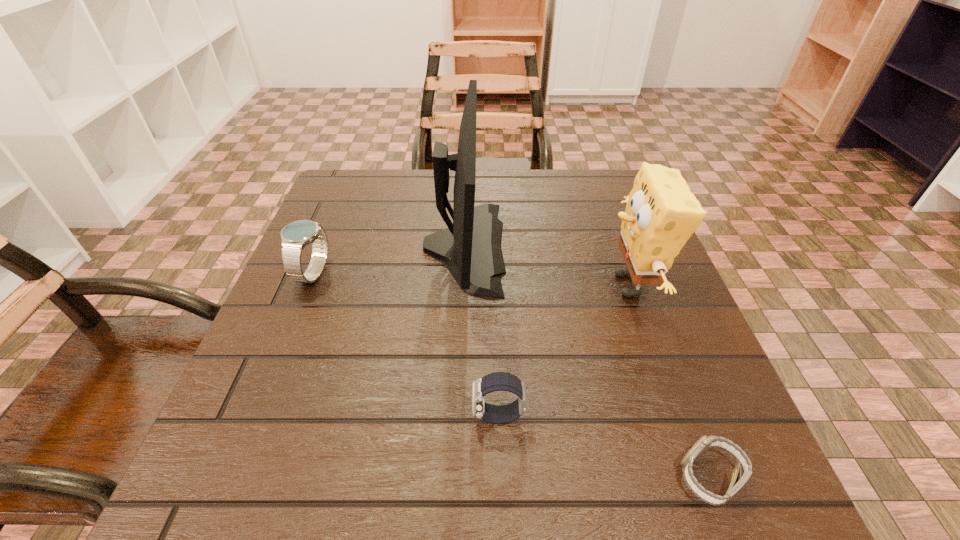
Where is `object present at the near edge`? The width and height of the screenshot is (960, 540). object present at the near edge is located at coordinates (705, 443).

At what (x,y) coordinates should I click in order to perform the action: click on object positioned at the left edge. Please return your answer as a coordinate pair (x, y). The image size is (960, 540). Looking at the image, I should click on pyautogui.click(x=295, y=236).

Find the location of a particular element. The width and height of the screenshot is (960, 540). sponge at the right edge is located at coordinates (661, 214).

You are a GUI agent. You are given a task and a screenshot of the screen. Output one action in this format:
    pyautogui.click(x=<x>, y=<y>)
    Task: Click on the watch positioned at the right edge
    
    Given the screenshot: What is the action you would take?
    pyautogui.click(x=705, y=443)

The height and width of the screenshot is (540, 960). Find the location of `object at the near right corner`. object at the near right corner is located at coordinates (705, 443).

In the image, there is a desktop. Where is `vacant space at the far edge`? vacant space at the far edge is located at coordinates (387, 216).

You are a GUI agent. You are given a task and a screenshot of the screen. Output one action in this format:
    pyautogui.click(x=<x>, y=<y>)
    Task: Click on the free space at the near edge
    
    Given the screenshot: What is the action you would take?
    pyautogui.click(x=455, y=475)

You are a GUI agent. You are given a task and a screenshot of the screen. Output one action in this format:
    pyautogui.click(x=<x>, y=<y>)
    Task: Click on the blank space at the left edge of the desktop
    
    Given the screenshot: What is the action you would take?
    pyautogui.click(x=300, y=402)

The width and height of the screenshot is (960, 540). In the image, there is a desktop. What are the coordinates of `vacant space at the right edge` in the screenshot? It's located at (709, 415).

The image size is (960, 540). What are the coordinates of `free region at the far right corner` in the screenshot? It's located at (576, 221).